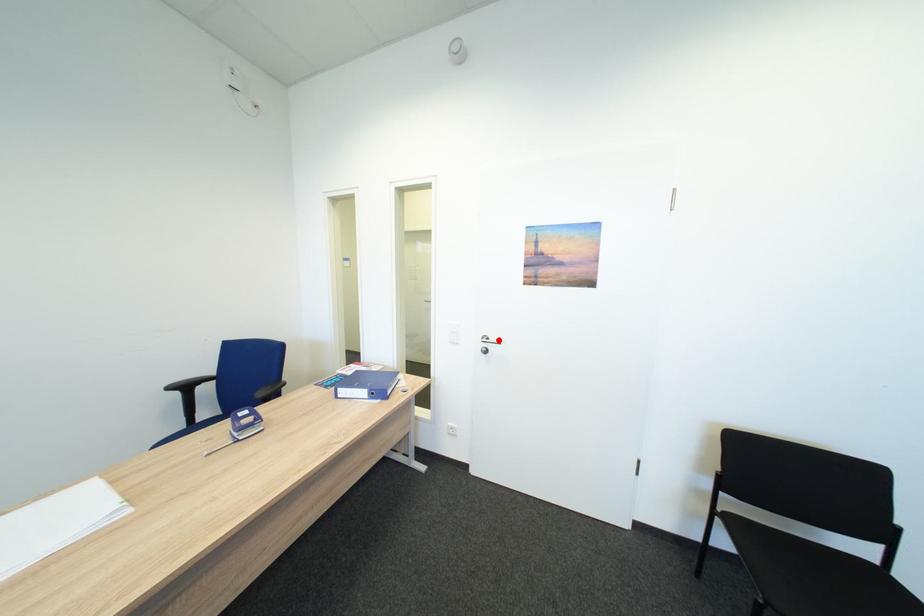
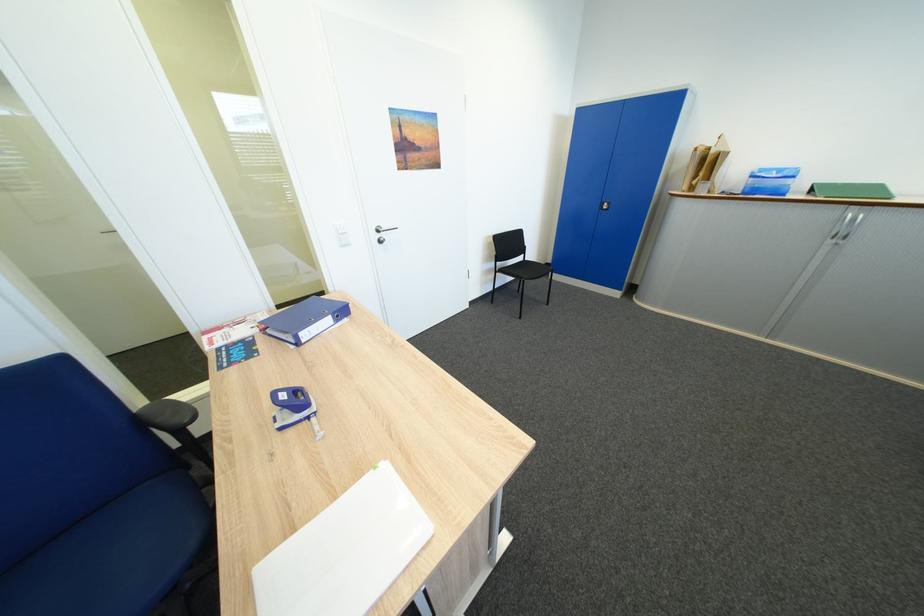
The point at the highlighted location is marked in the first image. Where is the corresponding point in the second image?

(392, 229)